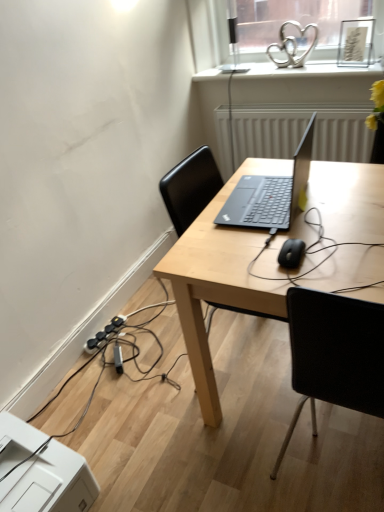
Where is `free space above white glossy heart-shaped object at upper center (from a real-world perspective)`? free space above white glossy heart-shaped object at upper center (from a real-world perspective) is located at coordinates (274, 65).